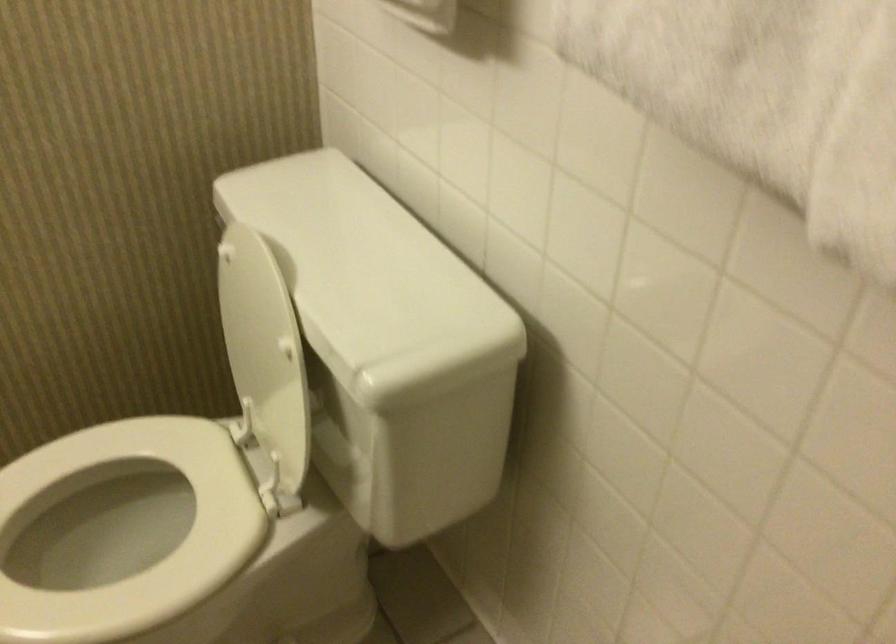
What do you see at coordinates (259, 343) in the screenshot? I see `the white toilet lid` at bounding box center [259, 343].